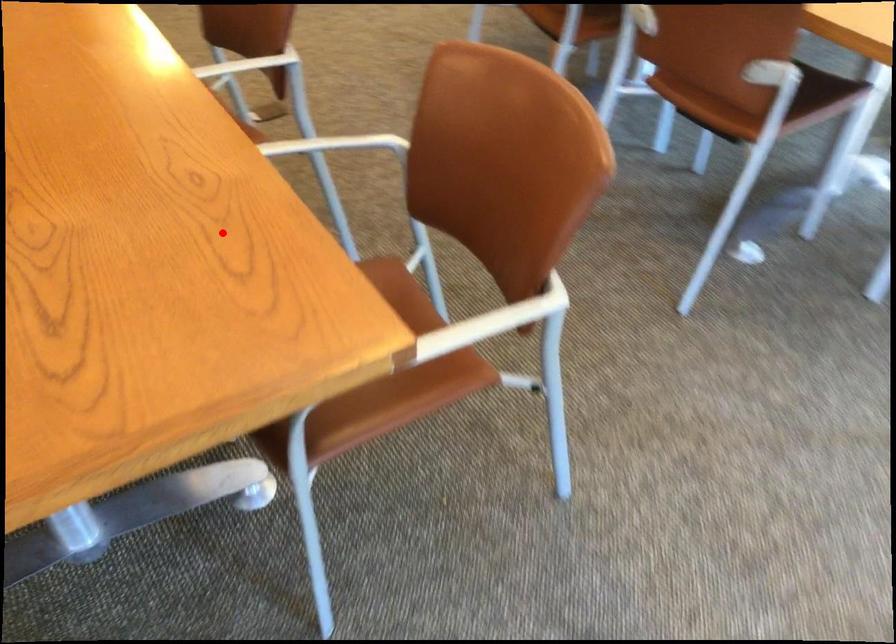
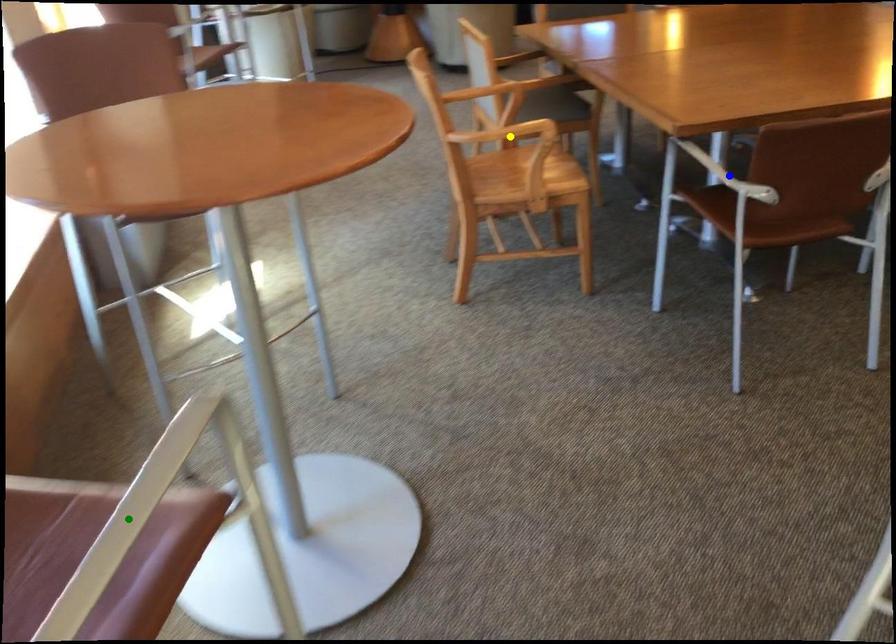
Question: I am providing you with two images of the same scene from different viewpoints. A red point is marked on the first image. You are given multiple points on the second image. Which point in image 2 represents the same 3d spot as the red point in image 1?

Choices:
 (A) blue point
 (B) green point
 (C) yellow point

Answer: (A)